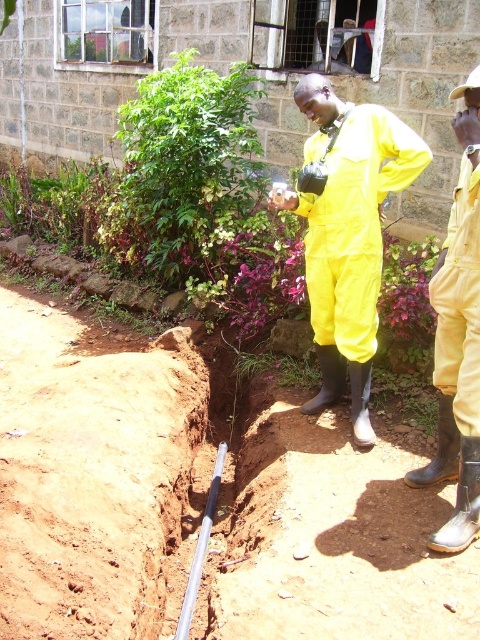
What do you see at coordinates (348, 234) in the screenshot? I see `yellow rubber suit at center` at bounding box center [348, 234].

Which is in front, point (333, 100) or point (478, 388)?

Point (478, 388) is in front.

Describe the element at coordinates (348, 234) in the screenshot. The width and height of the screenshot is (480, 640). I see `yellow rubber suit at center` at that location.

Find the location of `yellow rubber suit at center`. yellow rubber suit at center is located at coordinates (348, 234).